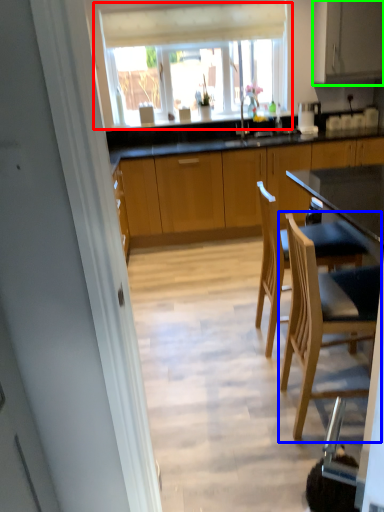
Question: Estimate the real-world distances between objects in this image. Which object is closer to window (highlighted by a red box), chair (highlighted by a blue box) or cabinetry (highlighted by a green box)?

Choices:
 (A) chair
 (B) cabinetry

Answer: (B)